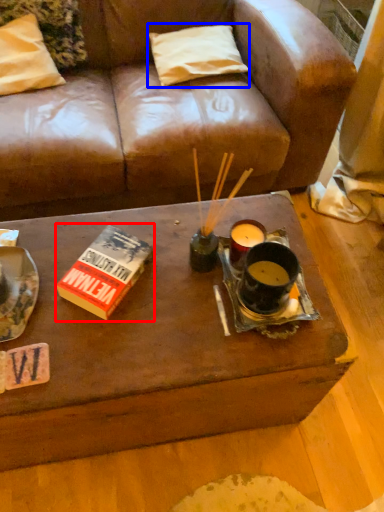
Question: Which object is closer to the camera taking this photo, paperback book (highlighted by a red box) or pillow (highlighted by a blue box)?

Choices:
 (A) paperback book
 (B) pillow

Answer: (A)